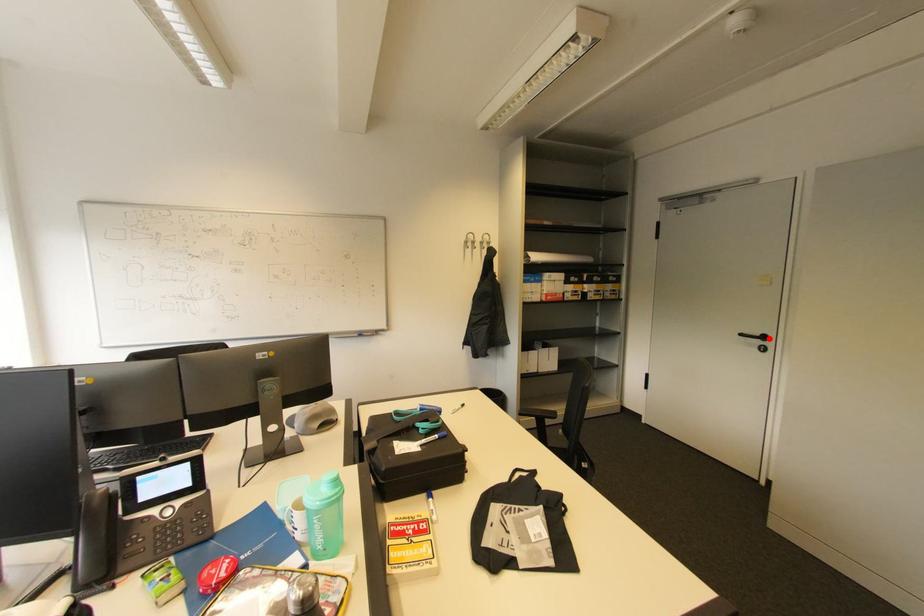
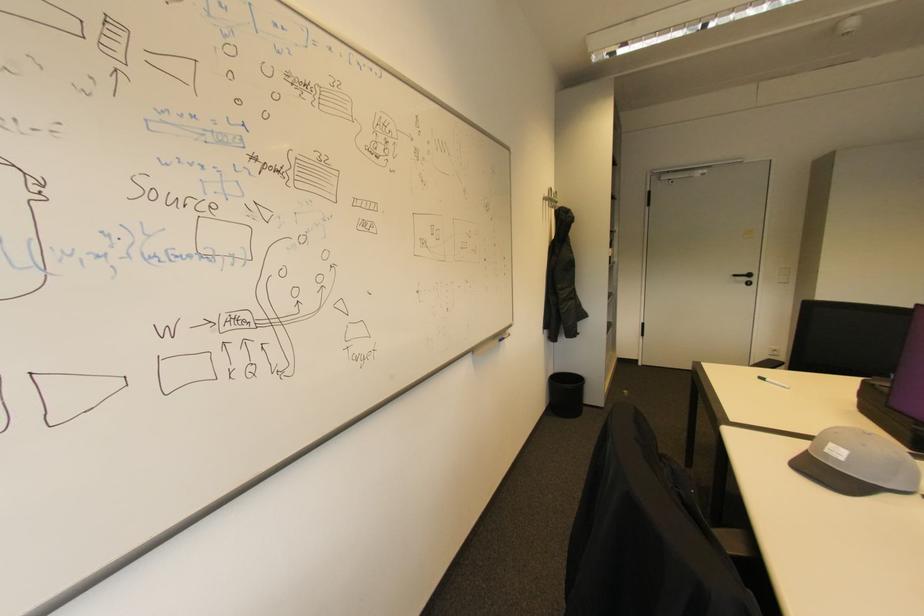
Locate, in the second image, the point that corresponds to the highlighted location in the first image.

(755, 276)